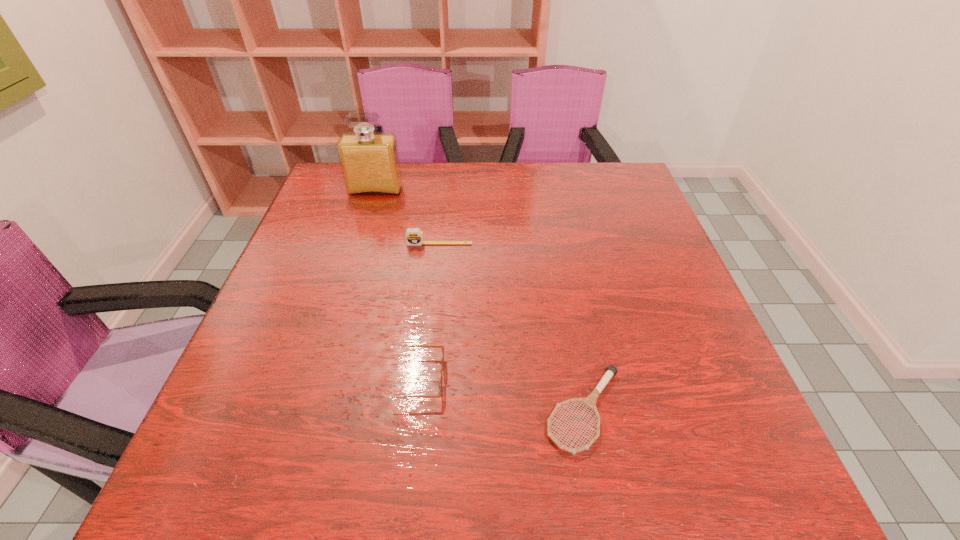
Select which object is the closest to the tallest object. Please provide its 2D coordinates. Your answer should be formatted as a tuple, i.e. [(x, y)], where the tuple contains the x and y coordinates of a point satisfying the conditions above.

[(414, 236)]

Select which object is the closest to the sunglasses. Please provide its 2D coordinates. Your answer should be formatted as a tuple, i.e. [(x, y)], where the tuple contains the x and y coordinates of a point satisfying the conditions above.

[(590, 401)]

Where is `free space in the image that satisfies the following two spatial constraints: 1. on the front-facing side of the sunglasses; 2. on the right side of the rightmost object`? This screenshot has height=540, width=960. free space in the image that satisfies the following two spatial constraints: 1. on the front-facing side of the sunglasses; 2. on the right side of the rightmost object is located at coordinates [x=409, y=410].

This screenshot has height=540, width=960. I want to click on vacant region that satisfies the following two spatial constraints: 1. on the front-facing side of the perfume; 2. on the left side of the rightmost object, so tap(308, 410).

At what (x,y) coordinates should I click in order to perform the action: click on free location that satisfies the following two spatial constraints: 1. on the front-facing side of the sunglasses; 2. on the right side of the rightmost object. Please return your answer as a coordinate pair (x, y). The image size is (960, 540). Looking at the image, I should click on (409, 410).

At what (x,y) coordinates should I click in order to perform the action: click on free location that satisfies the following two spatial constraints: 1. at the front of the second farthest object with the tape extended; 2. on the left side of the tennis racket. Please return your answer as a coordinate pair (x, y). This screenshot has height=540, width=960. Looking at the image, I should click on (422, 410).

Identify the location of vacant space that satisfies the following two spatial constraints: 1. at the front of the shortest object with the tape extended; 2. on the left side of the tape measure. (422, 410).

You are a GUI agent. You are given a task and a screenshot of the screen. Output one action in this format:
    pyautogui.click(x=<x>, y=<y>)
    Task: Click on the vacant point that satisfies the following two spatial constraints: 1. at the front of the tennis racket with the tape extended; 2. on the right side of the tape measure
    This screenshot has height=540, width=960.
    Given the screenshot: What is the action you would take?
    pyautogui.click(x=422, y=410)

Where is `free space that satisfies the following two spatial constraints: 1. on the back side of the tennis racket; 2. on the front-facing side of the sunglasses`? free space that satisfies the following two spatial constraints: 1. on the back side of the tennis racket; 2. on the front-facing side of the sunglasses is located at coordinates (579, 378).

The width and height of the screenshot is (960, 540). Find the location of `free space that satisfies the following two spatial constraints: 1. on the front-facing side of the rightmost object; 2. on the left side of the sunglasses`. free space that satisfies the following two spatial constraints: 1. on the front-facing side of the rightmost object; 2. on the left side of the sunglasses is located at coordinates (409, 410).